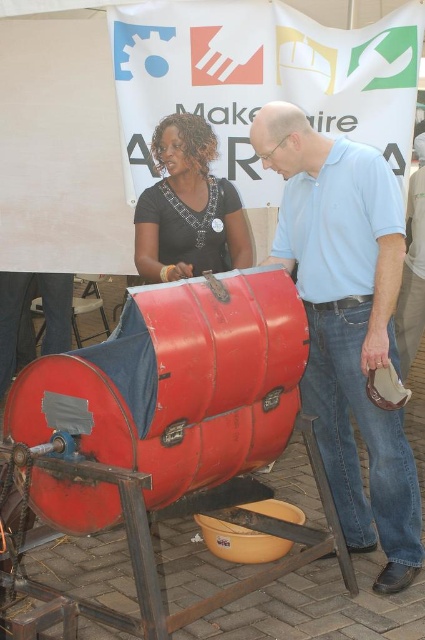
You are a photographer trying to capture both the light blue shirt at center and the matte black shirt at upper left in a single frame. Given their sizes, which shirt will appear more prominent in the photo?

The light blue shirt at center will appear more prominent in the photo because it is larger in size than the matte black shirt at upper left.

From the picture: You are a photographer trying to capture a photo of the light blue shirt at center and the matte black shirt at upper left. Since you want both shirts to be in focus, you need to know which one is taller. Which shirt is taller?

The light blue shirt at center is taller than the matte black shirt at upper left according to the description.

You are a photographer trying to capture a photo of the light blue shirt at center and the matte black shirt at upper left. If you want to ensure both shirts are fully visible in the frame, which shirt should you position closer to the camera to avoid cropping?

The light blue shirt at center might be wider than matte black shirt at upper left, so positioning the light blue shirt at center closer to the camera would help ensure it fits within the frame without being cropped.